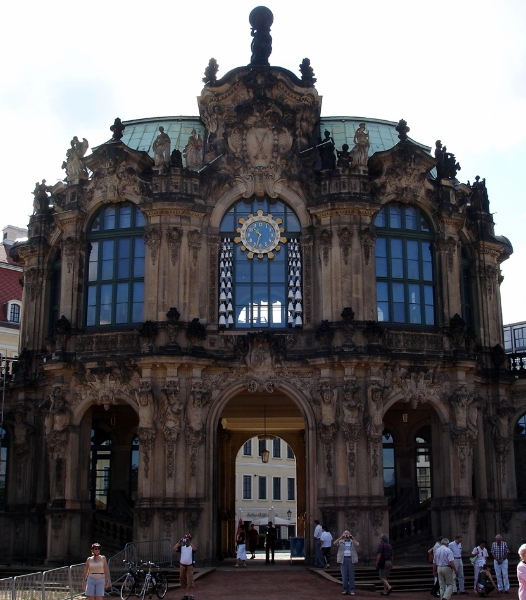
Find the location of a particular element. The height and width of the screenshot is (600, 526). lamp is located at coordinates pyautogui.click(x=263, y=459).